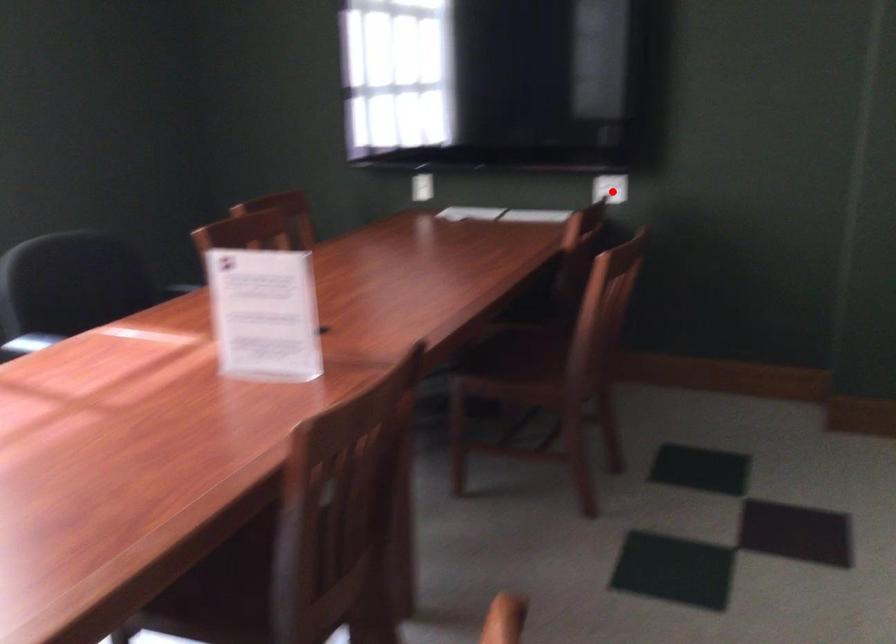
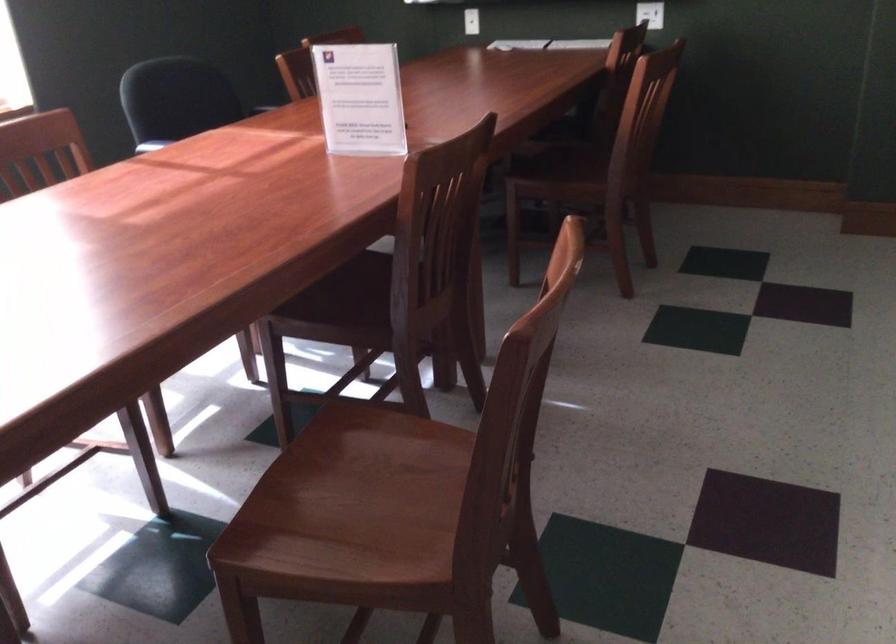
Where in the second image is the point corresponding to the highlighted location from the first image?

(650, 14)